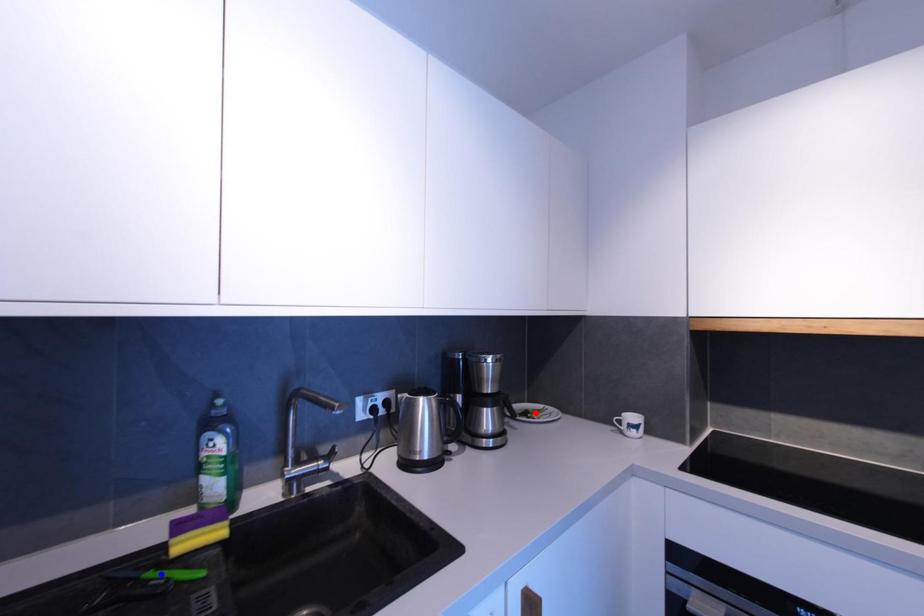
Question: Two points are marked on the image. Which point is closer to the camera?

Choices:
 (A) Blue point is closer.
 (B) Red point is closer.

Answer: (A)